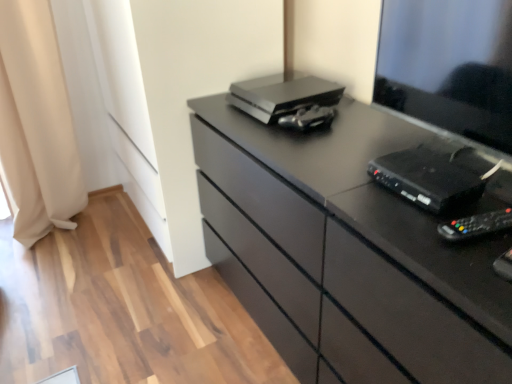
Locate an element on the screen. vacant space in front of beige fabric curtain at left is located at coordinates (59, 263).